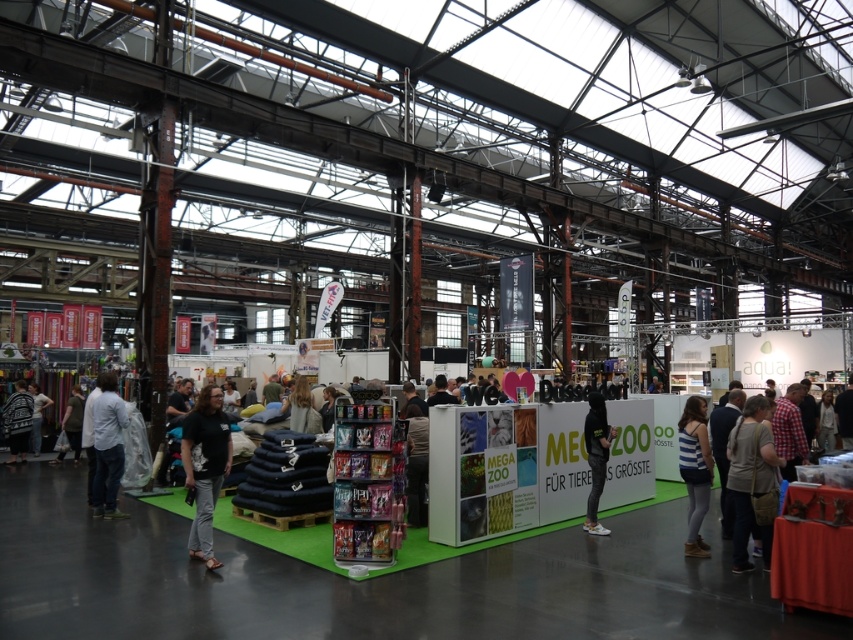
Locate an element on the screen. This screenshot has height=640, width=853. black cotton shirt at center is located at coordinates (206, 467).

Does black cotton shirt at center have a lesser width compared to blue striped tank top at center?

Incorrect, black cotton shirt at center's width is not less than blue striped tank top at center's.

Which is in front, point (213, 416) or point (695, 406)?

Point (213, 416) is in front.

Find the location of a particular element. This screenshot has height=640, width=853. black cotton shirt at center is located at coordinates (206, 467).

How much distance is there between black cotton shirt at center and light brown fabric bag at lower right?

black cotton shirt at center and light brown fabric bag at lower right are 5.87 meters apart.

Can you confirm if black cotton shirt at center is positioned to the left of light brown fabric bag at lower right?

Yes, black cotton shirt at center is to the left of light brown fabric bag at lower right.

Is point (204, 484) less distant than point (751, 451)?

No, it is not.

This screenshot has height=640, width=853. Find the location of `black cotton shirt at center`. black cotton shirt at center is located at coordinates (206, 467).

Which is more to the right, light brown fabric bag at lower right or black matte jacket at center?

light brown fabric bag at lower right

From the picture: Is light brown fabric bag at lower right smaller than black matte jacket at center?

Incorrect, light brown fabric bag at lower right is not smaller in size than black matte jacket at center.

Which is in front, point (743, 563) or point (601, 524)?

Point (743, 563) is more forward.

This screenshot has width=853, height=640. I want to click on light brown fabric bag at lower right, so click(x=749, y=472).